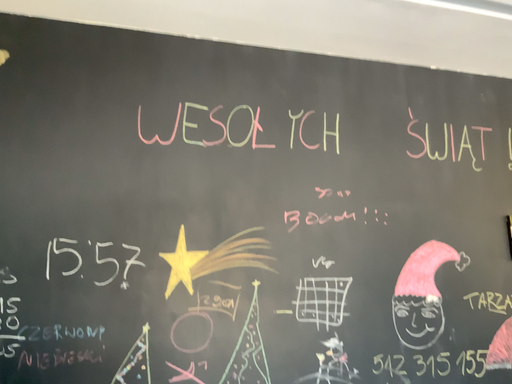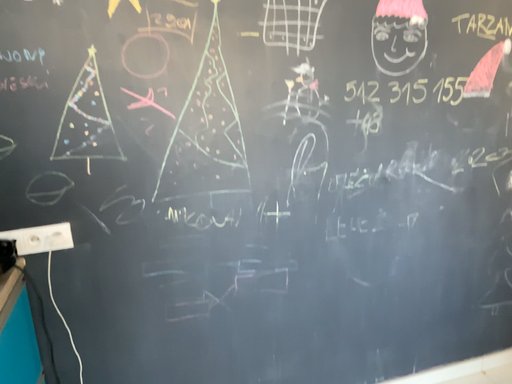
Question: Which way did the camera rotate in the video?

Choices:
 (A) rotated downward
 (B) rotated upward

Answer: (A)